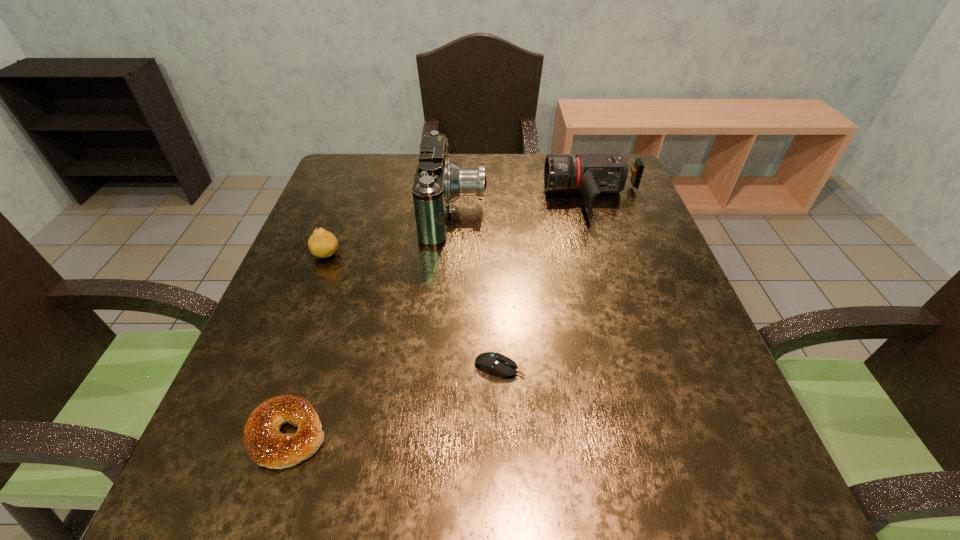
The width and height of the screenshot is (960, 540). I want to click on the left camcorder, so click(x=438, y=182).

The width and height of the screenshot is (960, 540). Find the location of `the tallest object`. the tallest object is located at coordinates (438, 182).

At what (x,y) coordinates should I click in order to perform the action: click on the shorter camcorder. Please return your answer as a coordinate pair (x, y). Looking at the image, I should click on (590, 175).

Locate an element on the screen. The height and width of the screenshot is (540, 960). the right camcorder is located at coordinates (590, 175).

At what (x,y) coordinates should I click in order to perform the action: click on pear. Please return your answer as a coordinate pair (x, y). This screenshot has width=960, height=540. Looking at the image, I should click on (322, 243).

Where is `the nearest object`? This screenshot has width=960, height=540. the nearest object is located at coordinates (265, 444).

Identify the location of bagel. The height and width of the screenshot is (540, 960). (265, 444).

This screenshot has height=540, width=960. I want to click on the shortest object, so click(490, 362).

You are a GUI agent. You are given a task and a screenshot of the screen. Output one action in this format:
    pyautogui.click(x=<x>, y=<y>)
    Task: Click on the fourth farthest object
    
    Given the screenshot: What is the action you would take?
    pyautogui.click(x=490, y=362)

I want to click on free space located 0.070m on the front-facing side of the tallest object, so click(x=514, y=213).